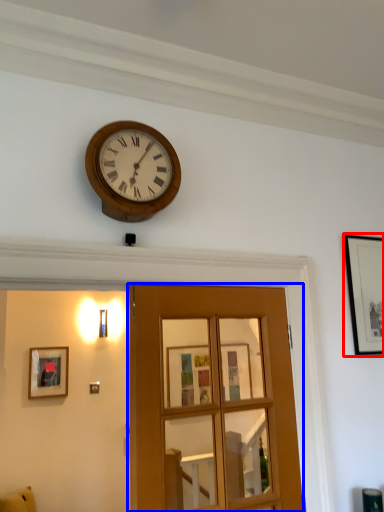
Question: Which object is further to the camera taking this photo, picture frame (highlighted by a red box) or door (highlighted by a blue box)?

Choices:
 (A) picture frame
 (B) door

Answer: (A)